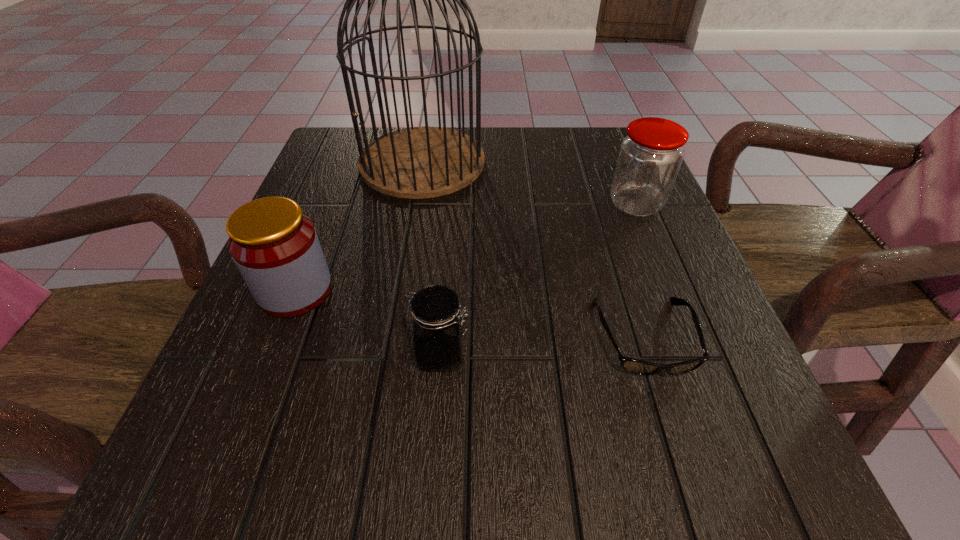
Locate an element on the screen. The height and width of the screenshot is (540, 960). free space between the second nearest jar and the shortest jar is located at coordinates (369, 322).

Where is `free spot between the spectacles and the tallest object`? The height and width of the screenshot is (540, 960). free spot between the spectacles and the tallest object is located at coordinates (534, 249).

The width and height of the screenshot is (960, 540). In order to click on vacant point located between the birdcage and the spectacles in this screenshot , I will do `click(534, 249)`.

Select which object is the second closest to the leftmost jar. Please provide its 2D coordinates. Your answer should be formatted as a tuple, i.e. [(x, y)], where the tuple contains the x and y coordinates of a point satisfying the conditions above.

[(416, 162)]

Locate which object ranks third in proximity to the farthest jar. Please provide its 2D coordinates. Your answer should be formatted as a tuple, i.e. [(x, y)], where the tuple contains the x and y coordinates of a point satisfying the conditions above.

[(438, 333)]

At what (x,y) coordinates should I click in order to perform the action: click on jar that stands as the closest to the leftmost jar. Please return your answer as a coordinate pair (x, y). This screenshot has width=960, height=540. Looking at the image, I should click on (438, 333).

Image resolution: width=960 pixels, height=540 pixels. I want to click on jar identified as the closest to the farthest jar, so [x=438, y=333].

Where is `vacant point that satisfies the following two spatial constraints: 1. at the door of the rightmost jar; 2. on the left side of the tallest object`? This screenshot has width=960, height=540. vacant point that satisfies the following two spatial constraints: 1. at the door of the rightmost jar; 2. on the left side of the tallest object is located at coordinates (415, 204).

Where is `vacant space that satisfies the following two spatial constraints: 1. at the door of the rightmost jar; 2. on the left side of the tallest object`? vacant space that satisfies the following two spatial constraints: 1. at the door of the rightmost jar; 2. on the left side of the tallest object is located at coordinates (415, 204).

This screenshot has height=540, width=960. I want to click on free point that satisfies the following two spatial constraints: 1. at the door of the birdcage; 2. on the left side of the farthest jar, so [415, 204].